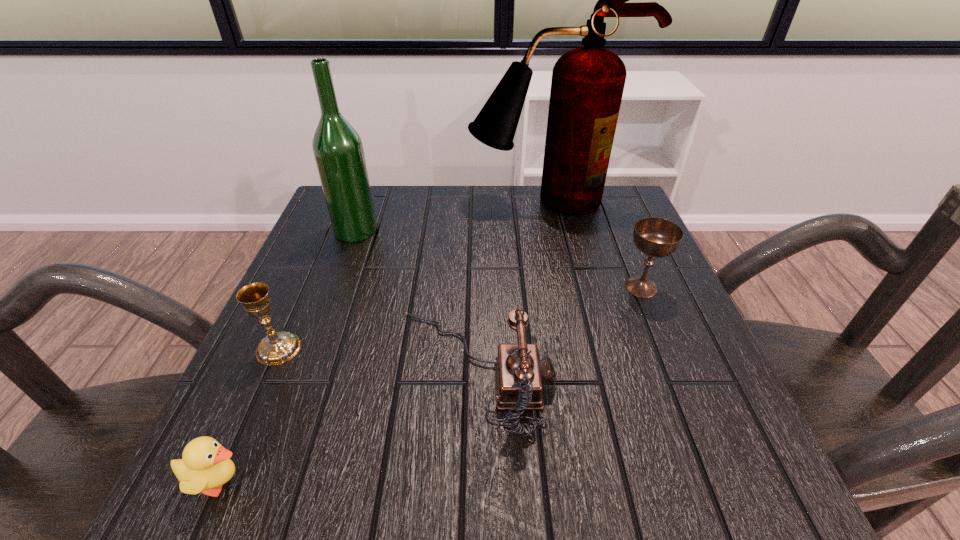
Locate an element on the screen. The width and height of the screenshot is (960, 540). free space between the farther chalice and the tallest object is located at coordinates [x=594, y=244].

Image resolution: width=960 pixels, height=540 pixels. What are the coordinates of `free space between the right chalice and the fifth nearest object` in the screenshot? It's located at (498, 259).

The height and width of the screenshot is (540, 960). Identify the location of free spot between the fourth nearest object and the fifth nearest object. (498, 259).

The image size is (960, 540). What are the coordinates of `vacant region between the left chalice and the telephone` in the screenshot? It's located at (376, 360).

Locate which object ranks fourth in proximity to the nearer chalice. Please provide its 2D coordinates. Your answer should be formatted as a tuple, i.e. [(x, y)], where the tuple contains the x and y coordinates of a point satisfying the conditions above.

[(587, 85)]

This screenshot has width=960, height=540. In order to click on object that is the fourth closest to the farthest object in this screenshot , I will do `click(276, 348)`.

Where is `vacant space that satisfies the following two spatial constraints: 1. at the nozzle of the fire extinguisher; 2. on the front-facing side of the shortest object`? vacant space that satisfies the following two spatial constraints: 1. at the nozzle of the fire extinguisher; 2. on the front-facing side of the shortest object is located at coordinates (610, 482).

Locate an element on the screen. vacant space that satisfies the following two spatial constraints: 1. at the nozzle of the farthest object; 2. on the left side of the third farthest object is located at coordinates (566, 287).

Image resolution: width=960 pixels, height=540 pixels. I want to click on vacant position in the image that satisfies the following two spatial constraints: 1. on the front side of the left chalice; 2. on the front-facing side of the nearest object, so click(220, 482).

The height and width of the screenshot is (540, 960). Find the location of `free space that satisfies the following two spatial constraints: 1. at the nozzle of the tallest object; 2. on the left side of the farther chalice`. free space that satisfies the following two spatial constraints: 1. at the nozzle of the tallest object; 2. on the left side of the farther chalice is located at coordinates (566, 287).